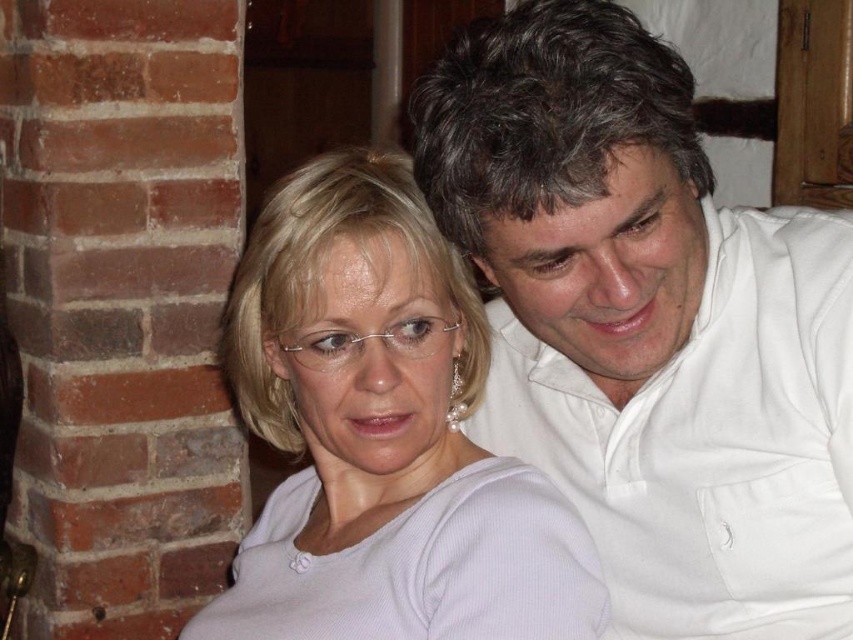
You are a photographer adjusting your camera settings to capture a closeup shot of the point at coordinates (540, 328). Based on the scene described, what distance should you set your camera focus to ensure the point is in sharp focus?

The point at coordinates (540, 328) is 32.55 inches from the camera, so you should set the camera focus to 32.55 inches to ensure it is in sharp focus.

You are designing a layout for a clothing catalog and need to place the white smooth shirt at upper right and white matte shirt at center. Given their sizes, which shirt should you prioritize placing first to ensure they fit well in the catalog spread?

The white smooth shirt at upper right should be placed first since it occupies less space than the white matte shirt at center, allowing more room for the larger shirt to be positioned appropriately.